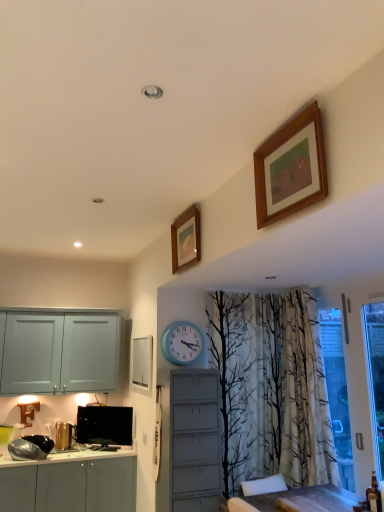
The image size is (384, 512). I want to click on vacant area on top of blue plastic clock at center (from a real-world perspective), so click(x=179, y=322).